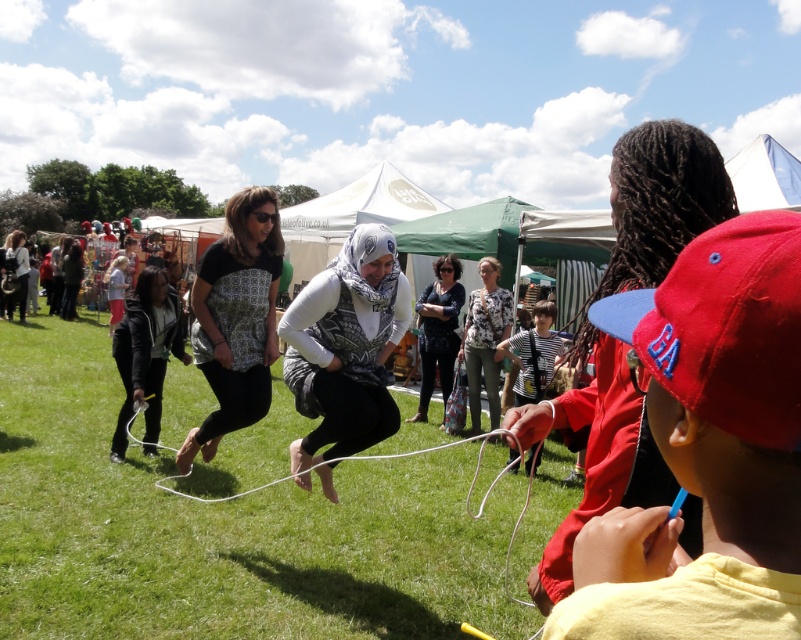
You are a photographer at the event and want to capture a photo of both the red cotton cap at right and the matte black shirt at center without any obstruction between them. Is this possible?

The red cotton cap at right is in front of the matte black shirt at center, so there will be an obstruction between them. You cannot capture both without obstruction.

You are a photographer standing at the edge of the green grass at center. You want to take a photo of the white matte scarf at center without any obstructions. Based on the distance between them, can you estimate if you can capture the scarf in your shot without moving closer?

The distance between the green grass at center and the white matte scarf at center is 9.05 feet. Since the scarf is positioned at center and there are no mentioned obstructions in the scene description, you should be able to capture the scarf in your shot without moving closer.

Please look at the image. There is a point at coordinates [223,528]. Based on the scene description, what is the color of the surface at that point?

The point at coordinates [223,528] is on green grass at center, so the color of the surface there is green.